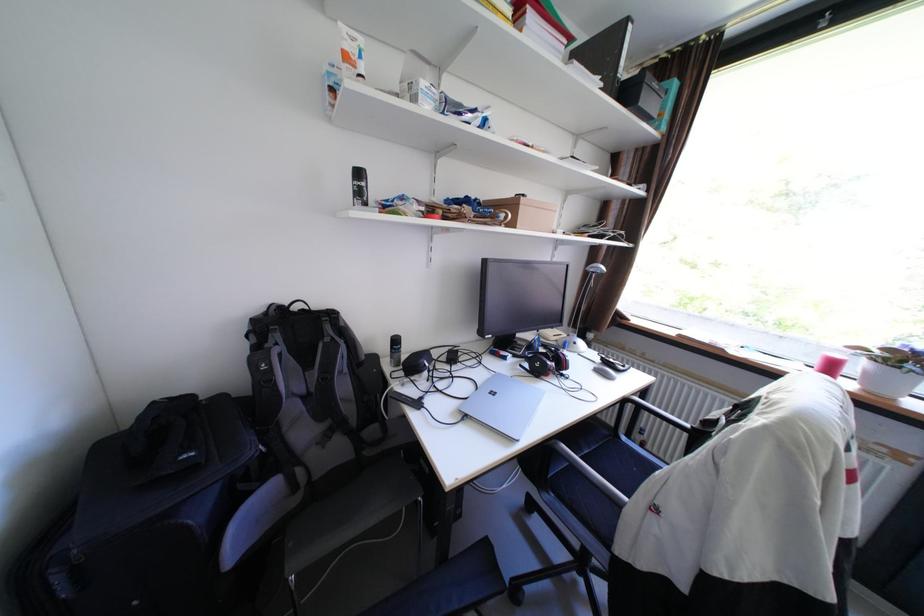
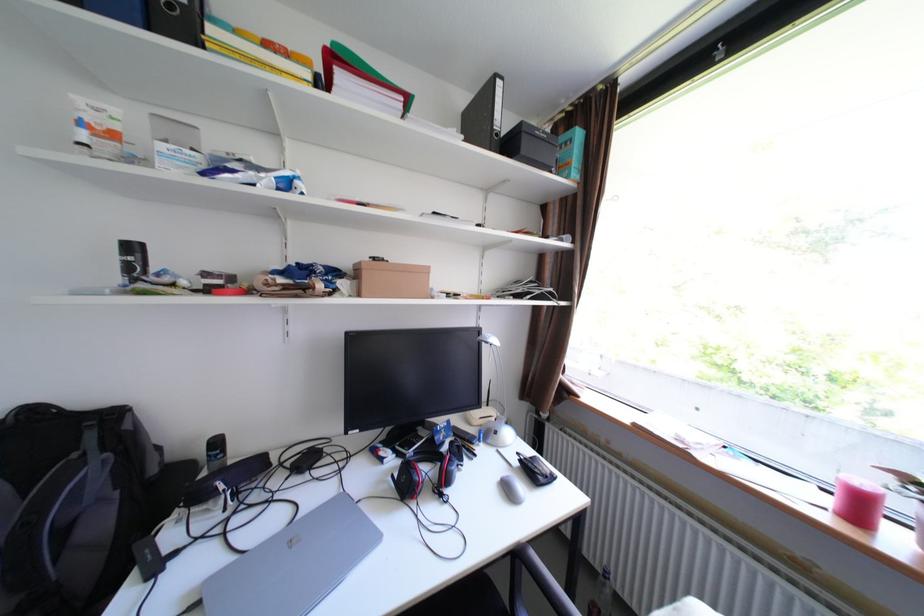
The point at (847, 355) is marked in the first image. Where is the corresponding point in the second image?

(874, 484)